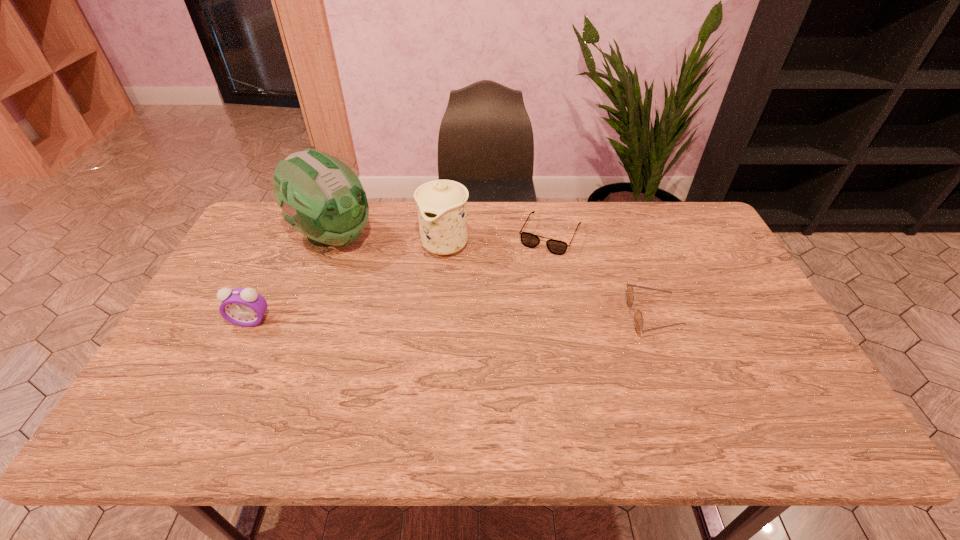
Where is `vacant area located on the spout of the chinaware`? This screenshot has width=960, height=540. vacant area located on the spout of the chinaware is located at coordinates (427, 278).

The image size is (960, 540). I want to click on vacant area situated on the spout of the chinaware, so click(x=387, y=347).

Identify the location of vacant space located on the spout of the chinaware. The width and height of the screenshot is (960, 540). (411, 306).

Where is `vacant space situated 0.250m on the visor of the tallest object`? This screenshot has height=540, width=960. vacant space situated 0.250m on the visor of the tallest object is located at coordinates (416, 289).

Identify the location of free space located 0.380m on the visor of the tallest object. (448, 310).

This screenshot has height=540, width=960. In order to click on blank space located 0.300m on the visor of the tallest object in this screenshot , I will do `click(428, 298)`.

You are a GUI agent. You are given a task and a screenshot of the screen. Output one action in this format:
    pyautogui.click(x=<x>, y=<y>)
    Task: Click on the free space located on the front-facing side of the fourth object from left to right
    The width and height of the screenshot is (960, 540).
    Given the screenshot: What is the action you would take?
    pyautogui.click(x=524, y=289)

Locate an element on the screen. The width and height of the screenshot is (960, 540). free space located on the front-facing side of the fourth object from left to right is located at coordinates (525, 287).

The width and height of the screenshot is (960, 540). I want to click on free region located 0.100m on the front-facing side of the fourth object from left to right, so click(531, 274).

This screenshot has height=540, width=960. Identify the location of chinaware positioned at the far edge. (441, 204).